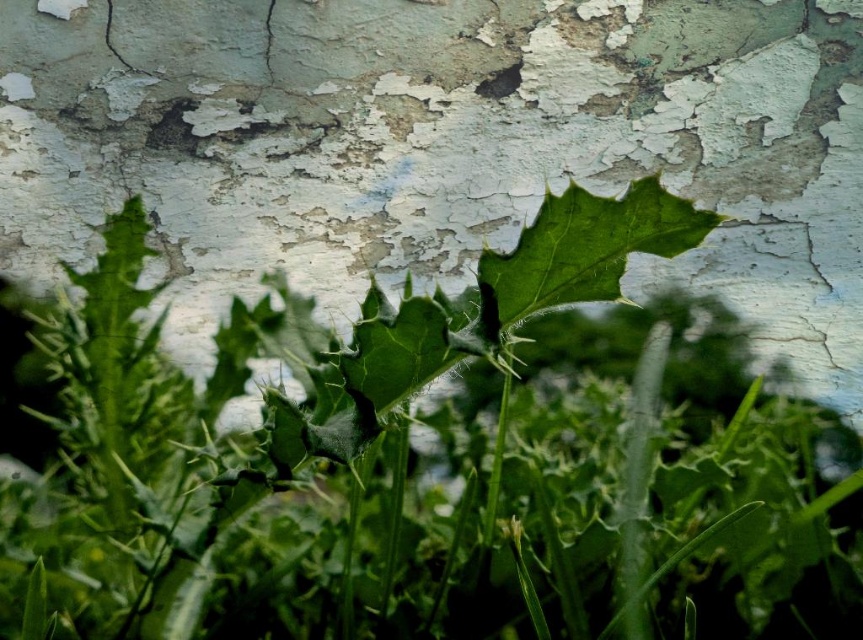
Is the position of green spiky leaf at center more distant than that of green matte leaf at center?

Yes, green spiky leaf at center is further from the viewer.

Can you confirm if green spiky leaf at center is taller than green matte leaf at center?

Yes.

Which is behind, point (196, 396) or point (600, 214)?

The point (196, 396) is more distant.

Locate an element on the screen. Image resolution: width=863 pixels, height=640 pixels. green spiky leaf at center is located at coordinates (408, 460).